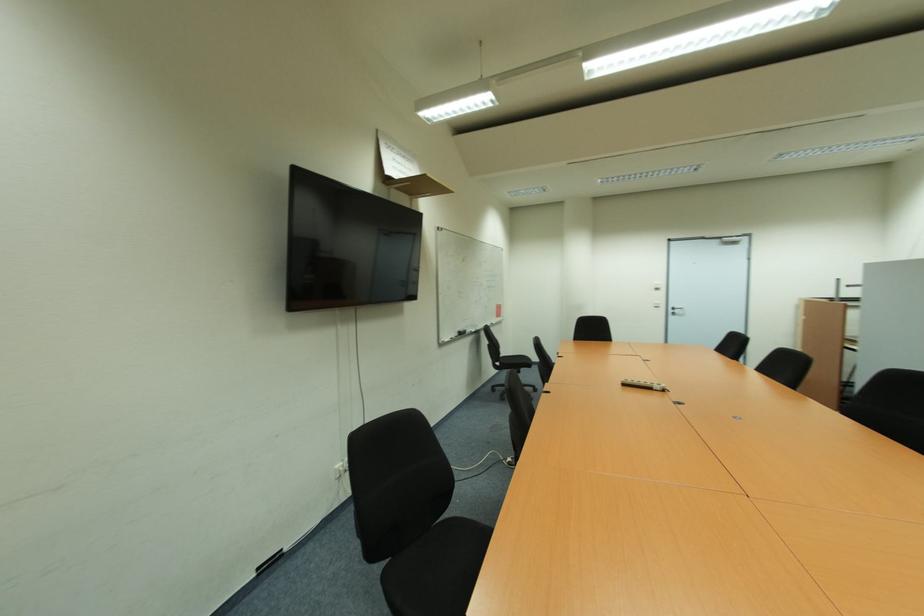
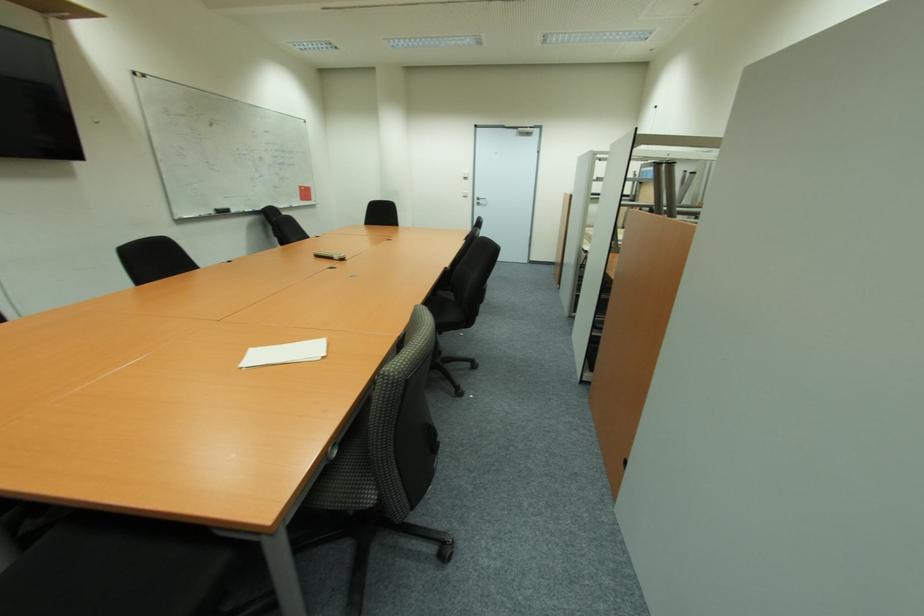
Question: The images are taken continuously from a first-person perspective. In which direction are you moving?

Choices:
 (A) Left
 (B) Right
 (C) Forward
 (D) Backward

Answer: (B)